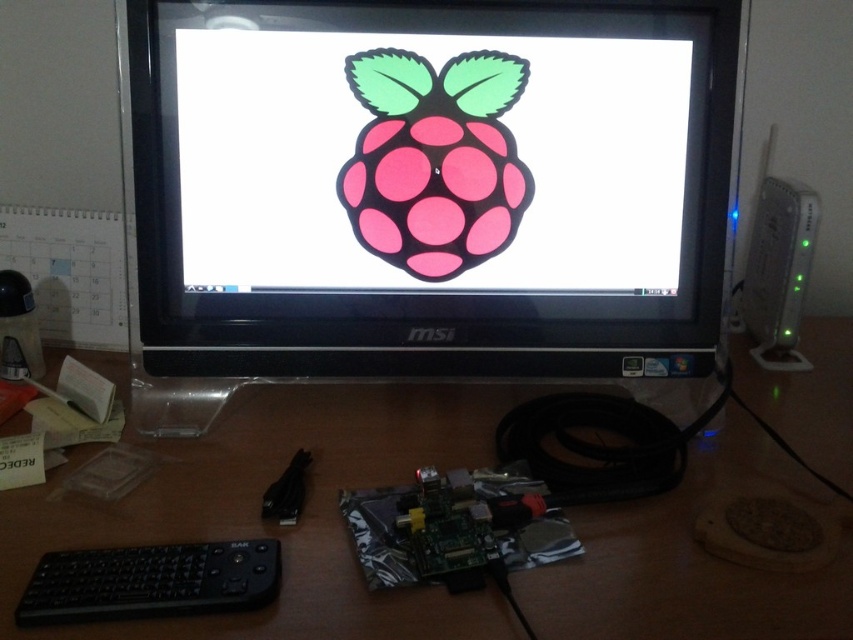
Question: Is wooden at center wider than black matte keyboard at lower left?

Choices:
 (A) yes
 (B) no

Answer: (A)

Question: Is black plastic monitor at center thinner than wooden at center?

Choices:
 (A) no
 (B) yes

Answer: (B)

Question: Among these objects, which one is nearest to the camera?

Choices:
 (A) black matte keyboard at lower left
 (B) wooden at center

Answer: (B)

Question: Which object is closer to the camera taking this photo?

Choices:
 (A) black plastic monitor at center
 (B) wooden at center

Answer: (B)

Question: Which object appears closest to the camera in this image?

Choices:
 (A) black plastic monitor at center
 (B) wooden at center

Answer: (B)

Question: Is wooden at center smaller than black matte keyboard at lower left?

Choices:
 (A) no
 (B) yes

Answer: (A)